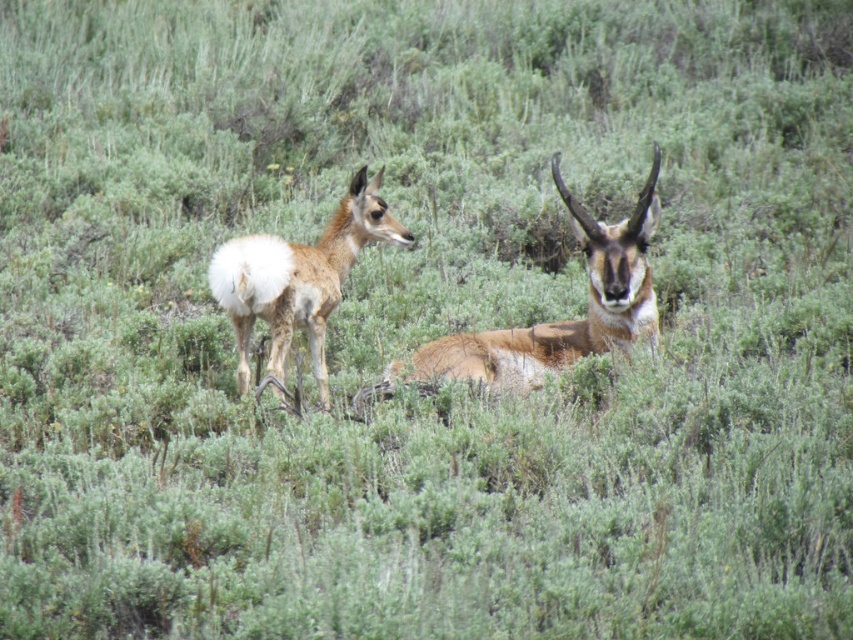
You are a wildlife photographer aiming to capture a closeup of the brown fuzzy antelope at center. You are currently positioned at the point marked by coordinate point [566,321]. Is this point a good location to take the photo?

The point marked by coordinate point [566,321] marks brown fuzzy antelope at center, so yes, this is a good location to take the photo as it directly corresponds to the position of the brown fuzzy antelope at center.

You are a wildlife photographer aiming to capture a closeup shot of the brown fuzzy antelope at center. Your camera has a maximum zoom range of 3 meters. Can you get a clear closeup without moving closer physically?

The brown fuzzy antelope at center is 4.23 meters away from the camera, which is beyond the maximum zoom range of 3 meters. Therefore, you cannot get a clear closeup without moving closer physically.

You are a wildlife photographer trying to capture both the brown fuzzy antelope at center and the brown fur antelope at center in a single frame. Given that your camera has a fixed focal length, which antelope should you focus on first to ensure both fit in the frame?

The brown fuzzy antelope at center is larger in width than the brown fur antelope at center. To ensure both fit in the frame, focus on the brown fuzzy antelope at center first as it requires more space, and adjust the camera settings accordingly to include the smaller brown fur antelope at center.